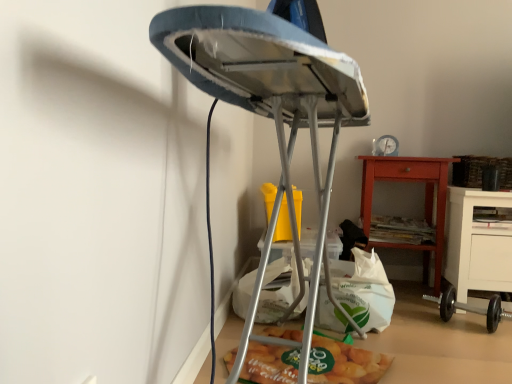
I want to click on free spot in front of black rubber dumbbell at lower right, so click(473, 345).